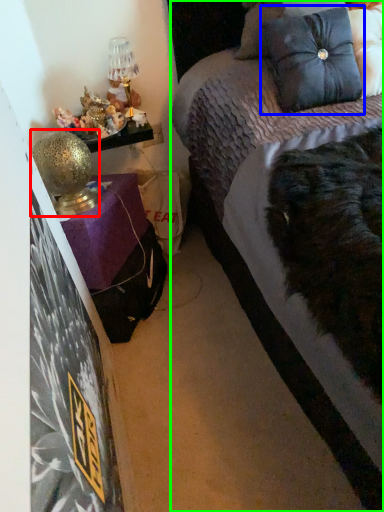
Question: Estimate the real-world distances between objects in this image. Which object is closer to table lamp (highlighted by a red box), pillow (highlighted by a blue box) or bed (highlighted by a green box)?

Choices:
 (A) pillow
 (B) bed

Answer: (B)